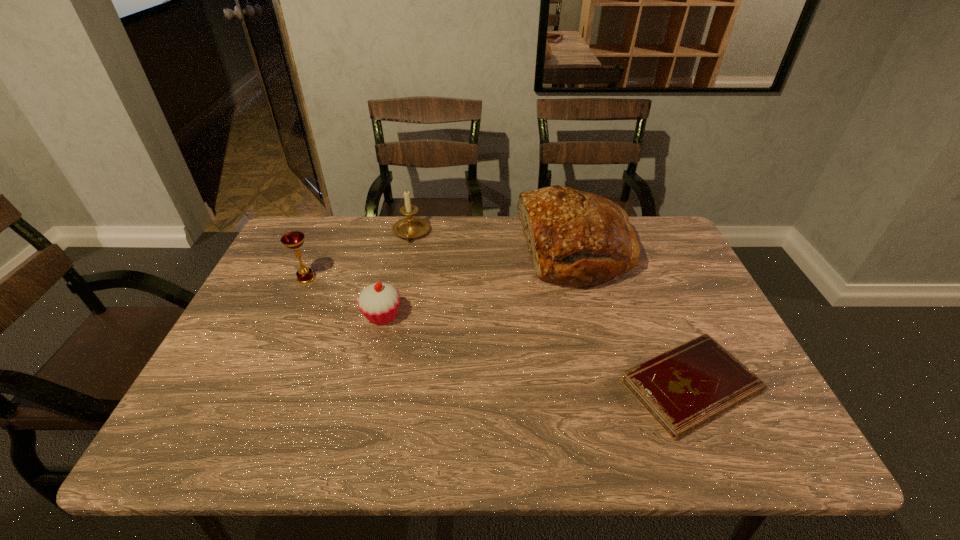
Where is `vacant space that satisfies the following two spatial constraints: 1. at the sliced front of the nearest object; 2. on the right side of the tallest object`? The image size is (960, 540). vacant space that satisfies the following two spatial constraints: 1. at the sliced front of the nearest object; 2. on the right side of the tallest object is located at coordinates (612, 386).

Where is `free space that satisfies the following two spatial constraints: 1. at the sliced front of the tallest object; 2. on the left side of the shortest object`? The width and height of the screenshot is (960, 540). free space that satisfies the following two spatial constraints: 1. at the sliced front of the tallest object; 2. on the left side of the shortest object is located at coordinates (612, 386).